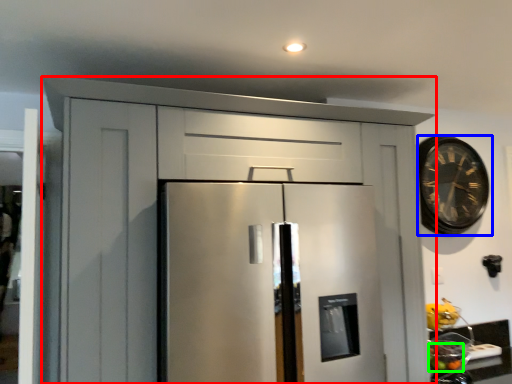
Question: Considering the real-world distances, which object is closest to cabinetry (highlighted by a red box)? clock (highlighted by a blue box) or fruit (highlighted by a green box).

Choices:
 (A) clock
 (B) fruit

Answer: (A)